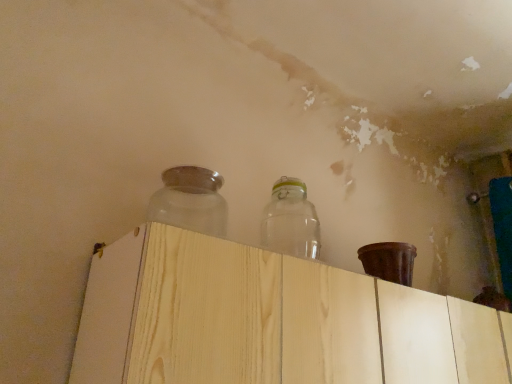
Question: Can you confirm if frosted glass jar at upper center, positioned as the second bottle in right-to-left order, is wider than light wood dresser at center?

Choices:
 (A) no
 (B) yes

Answer: (A)

Question: From a real-world perspective, is frosted glass jar at upper center, the 1th bottle viewed from the left, over light wood dresser at center?

Choices:
 (A) no
 (B) yes

Answer: (B)

Question: Is frosted glass jar at upper center, the 1th bottle viewed from the left, positioned beyond the bounds of light wood dresser at center?

Choices:
 (A) no
 (B) yes

Answer: (B)

Question: From a real-world perspective, is frosted glass jar at upper center, the 1th bottle viewed from the left, physically below light wood dresser at center?

Choices:
 (A) yes
 (B) no

Answer: (B)

Question: From the image's perspective, is frosted glass jar at upper center, positioned as the second bottle in right-to-left order, located above light wood dresser at center?

Choices:
 (A) no
 (B) yes

Answer: (B)

Question: Is frosted glass jar at upper center, positioned as the second bottle in right-to-left order, facing towards light wood dresser at center?

Choices:
 (A) yes
 (B) no

Answer: (B)

Question: Can you confirm if frosted glass jar at upper center, positioned as the second bottle in right-to-left order, is positioned to the left of transparent glass jar at upper center, arranged as the first bottle when viewed from the right?

Choices:
 (A) yes
 (B) no

Answer: (A)

Question: Is frosted glass jar at upper center, positioned as the second bottle in right-to-left order, touching transparent glass jar at upper center, arranged as the first bottle when viewed from the right?

Choices:
 (A) no
 (B) yes

Answer: (A)

Question: From the image's perspective, is frosted glass jar at upper center, the 1th bottle viewed from the left, located above transparent glass jar at upper center, arranged as the first bottle when viewed from the right?

Choices:
 (A) yes
 (B) no

Answer: (A)

Question: Considering the relative positions of frosted glass jar at upper center, positioned as the second bottle in right-to-left order, and transparent glass jar at upper center, the 2th bottle when ordered from left to right, in the image provided, is frosted glass jar at upper center, positioned as the second bottle in right-to-left order, in front of transparent glass jar at upper center, the 2th bottle when ordered from left to right,?

Choices:
 (A) no
 (B) yes

Answer: (B)

Question: Is frosted glass jar at upper center, the 1th bottle viewed from the left, facing away from transparent glass jar at upper center, the 2th bottle when ordered from left to right?

Choices:
 (A) yes
 (B) no

Answer: (B)

Question: Is transparent glass jar at upper center, the 2th bottle when ordered from left to right, completely or partially inside frosted glass jar at upper center, the 1th bottle viewed from the left?

Choices:
 (A) no
 (B) yes

Answer: (A)

Question: From a real-world perspective, is light wood dresser at center beneath frosted glass jar at upper center, the 1th bottle viewed from the left?

Choices:
 (A) yes
 (B) no

Answer: (A)